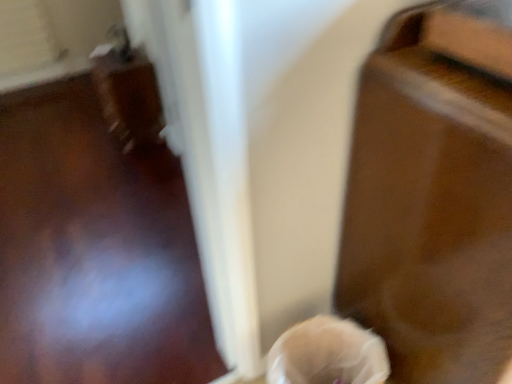
Question: Does translucent plastic bag at lower center have a smaller size compared to glossy wood table at right?

Choices:
 (A) no
 (B) yes

Answer: (B)

Question: Would you say translucent plastic bag at lower center contains glossy wood table at right?

Choices:
 (A) no
 (B) yes

Answer: (A)

Question: Does translucent plastic bag at lower center appear on the right side of glossy wood table at right?

Choices:
 (A) yes
 (B) no

Answer: (B)

Question: From the image's perspective, is translucent plastic bag at lower center on top of glossy wood table at right?

Choices:
 (A) no
 (B) yes

Answer: (A)

Question: Does translucent plastic bag at lower center have a lesser height compared to glossy wood table at right?

Choices:
 (A) yes
 (B) no

Answer: (A)

Question: From a real-world perspective, is translucent plastic bag at lower center physically below glossy wood table at right?

Choices:
 (A) no
 (B) yes

Answer: (B)

Question: From a real-world perspective, is glossy wood table at right positioned over translucent plastic bag at lower center based on gravity?

Choices:
 (A) yes
 (B) no

Answer: (A)

Question: Is the surface of glossy wood table at right in direct contact with translucent plastic bag at lower center?

Choices:
 (A) no
 (B) yes

Answer: (A)

Question: Is glossy wood table at right further to the viewer compared to translucent plastic bag at lower center?

Choices:
 (A) yes
 (B) no

Answer: (B)

Question: Does glossy wood table at right contain translucent plastic bag at lower center?

Choices:
 (A) yes
 (B) no

Answer: (B)

Question: Can you confirm if glossy wood table at right is thinner than translucent plastic bag at lower center?

Choices:
 (A) yes
 (B) no

Answer: (B)

Question: From a real-world perspective, is glossy wood table at right beneath translucent plastic bag at lower center?

Choices:
 (A) no
 (B) yes

Answer: (A)

Question: Does point (317, 365) appear closer or farther from the camera than point (437, 148)?

Choices:
 (A) closer
 (B) farther

Answer: (B)